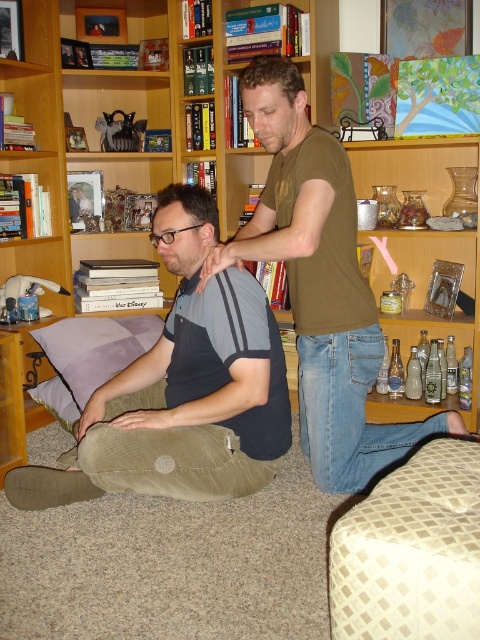
You are a delivery person who needs to place a package between the wooden bookshelf at center and the matte brown shirt at center. According to the scene description, which side should you place the package on?

The wooden bookshelf at center is positioned on the left side of matte brown shirt at center. Therefore, you should place the package on the right side of the wooden bookshelf at center or the left side of the matte brown shirt at center to position it between them.

You are organizing a small party in the living room and need to place a large decorative item that requires a stable surface. Which object between the wooden bookshelf at center and the matte brown shirt at center would be more suitable for placing the item?

The wooden bookshelf at center is bigger than the matte brown shirt at center, making it more stable and suitable for placing the large decorative item.

You are a physical therapist observing the scene. You need to place a support pillow under the dark brown hair at center to improve posture. Can the purple fabric pillow at lower left be used for this purpose?

The purple fabric pillow at lower left has a larger size compared to dark brown hair at center, so it can be used as a support pillow under the dark brown hair at center to improve posture.